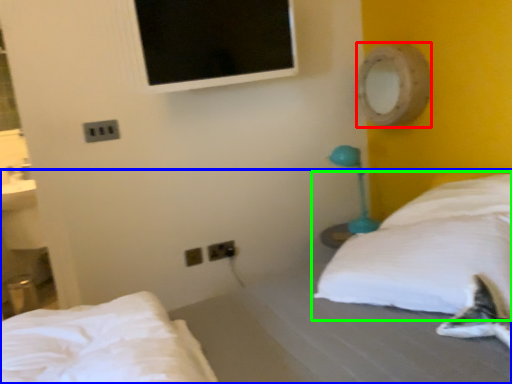
Question: Considering the real-world distances, which object is closest to mirror (highlighted by a red box)? bed (highlighted by a blue box) or pillow (highlighted by a green box).

Choices:
 (A) bed
 (B) pillow

Answer: (B)